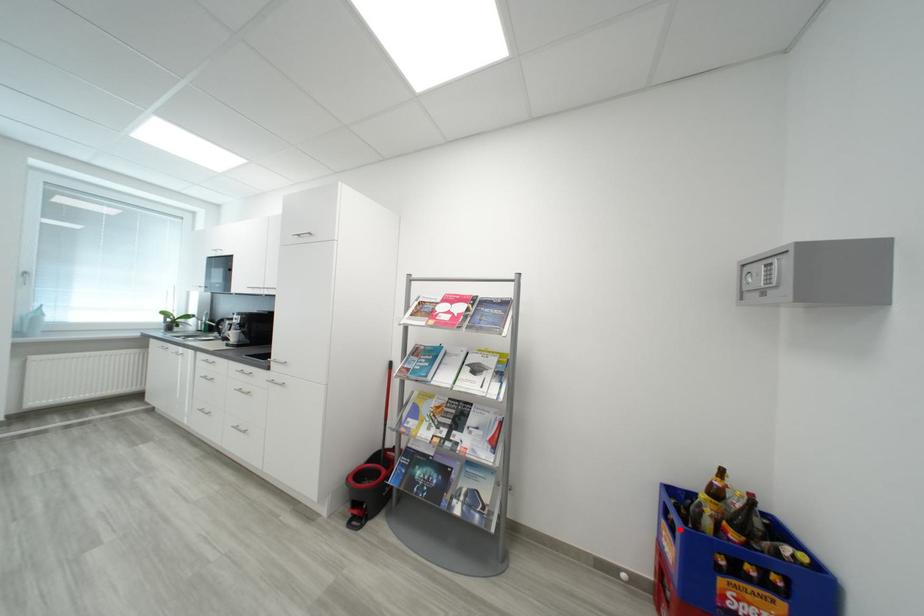
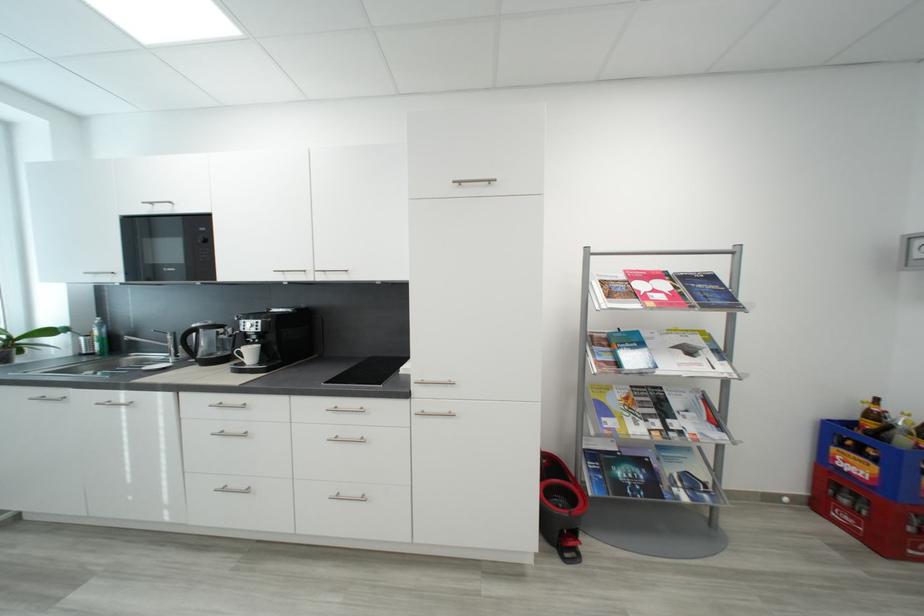
In the second image, find the point that corresponds to the highlighted location in the first image.

(867, 454)